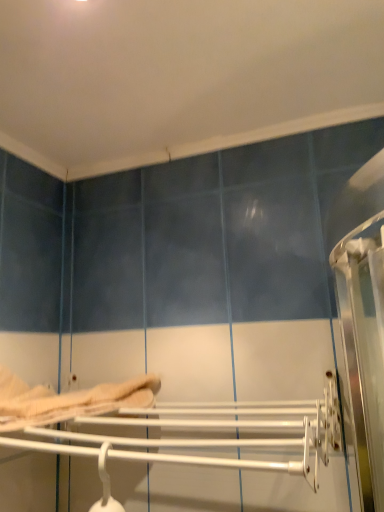
Question: Should I look upward or downward to see beige fabric bed at lower left?

Choices:
 (A) up
 (B) down

Answer: (B)

Question: Can we say beige fabric bed at lower left lies outside white glossy towel rack at center?

Choices:
 (A) yes
 (B) no

Answer: (A)

Question: Could you tell me if beige fabric bed at lower left is facing white glossy towel rack at center?

Choices:
 (A) yes
 (B) no

Answer: (B)

Question: Does beige fabric bed at lower left have a smaller size compared to white glossy towel rack at center?

Choices:
 (A) yes
 (B) no

Answer: (A)

Question: Is beige fabric bed at lower left positioned far away from white glossy towel rack at center?

Choices:
 (A) yes
 (B) no

Answer: (B)

Question: Can you confirm if beige fabric bed at lower left is shorter than white glossy towel rack at center?

Choices:
 (A) no
 (B) yes

Answer: (B)

Question: Is beige fabric bed at lower left to the right of white glossy towel rack at center from the viewer's perspective?

Choices:
 (A) yes
 (B) no

Answer: (B)

Question: Considering the relative sizes of white glossy towel rack at center and beige fabric bed at lower left in the image provided, is white glossy towel rack at center smaller than beige fabric bed at lower left?

Choices:
 (A) yes
 (B) no

Answer: (B)

Question: From the image's perspective, is white glossy towel rack at center above beige fabric bed at lower left?

Choices:
 (A) yes
 (B) no

Answer: (B)

Question: From a real-world perspective, is white glossy towel rack at center beneath beige fabric bed at lower left?

Choices:
 (A) yes
 (B) no

Answer: (A)

Question: Is white glossy towel rack at center in contact with beige fabric bed at lower left?

Choices:
 (A) yes
 (B) no

Answer: (B)

Question: Is beige fabric bed at lower left at the back of white glossy towel rack at center?

Choices:
 (A) yes
 (B) no

Answer: (B)

Question: Is white glossy towel rack at center located outside beige fabric bed at lower left?

Choices:
 (A) yes
 (B) no

Answer: (A)

Question: From a real-world perspective, is white glossy towel rack at center physically located above or below beige fabric bed at lower left?

Choices:
 (A) above
 (B) below

Answer: (B)